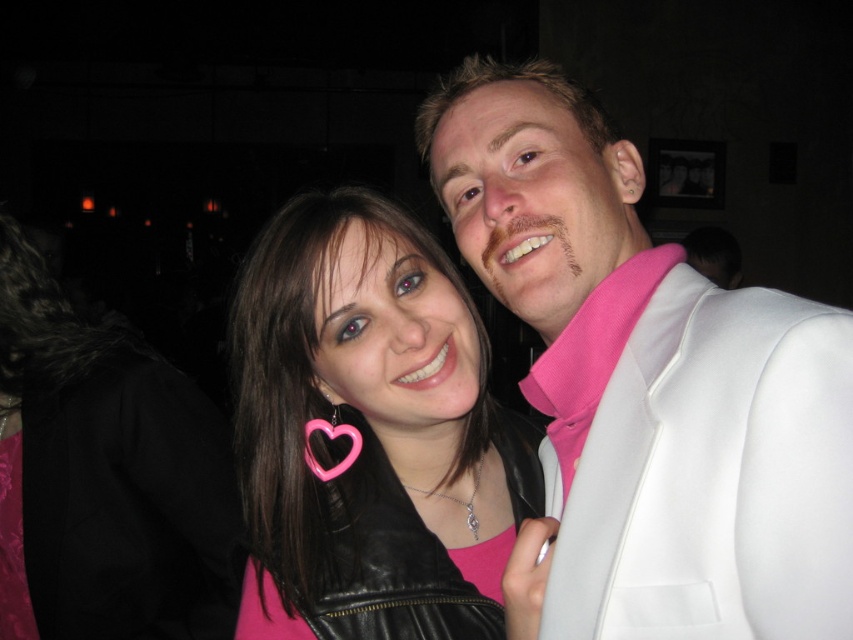
Question: Does pink matte heart-shaped earring at center have a lesser width compared to pink matte heart-shaped earrings at upper center?

Choices:
 (A) no
 (B) yes

Answer: (B)

Question: Can you confirm if pink matte heart-shaped earring at center is bigger than pink matte heart-shaped earrings at upper center?

Choices:
 (A) yes
 (B) no

Answer: (B)

Question: Which object is farther from the camera taking this photo?

Choices:
 (A) pink matte heart-shaped earrings at upper center
 (B) pink matte heart-shaped earring at center
 (C) white satin suit at upper right

Answer: (A)

Question: Which object is closer to the camera taking this photo?

Choices:
 (A) pink matte heart-shaped earrings at upper center
 (B) white satin suit at upper right
 (C) pink matte heart-shaped earring at center

Answer: (B)

Question: Estimate the real-world distances between objects in this image. Which object is closer to the pink matte heart-shaped earrings at upper center?

Choices:
 (A) white satin suit at upper right
 (B) pink matte heart-shaped earring at center

Answer: (B)

Question: Is white satin suit at upper right bigger than pink matte heart-shaped earring at center?

Choices:
 (A) yes
 (B) no

Answer: (B)